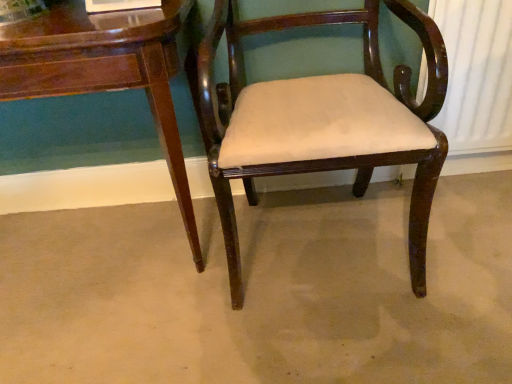
At what (x,y) coordinates should I click in order to perform the action: click on vacant space in between glossy wood table at lower left and mahogany wood chair at center. Please return your answer as a coordinate pair (x, y). Looking at the image, I should click on (142, 295).